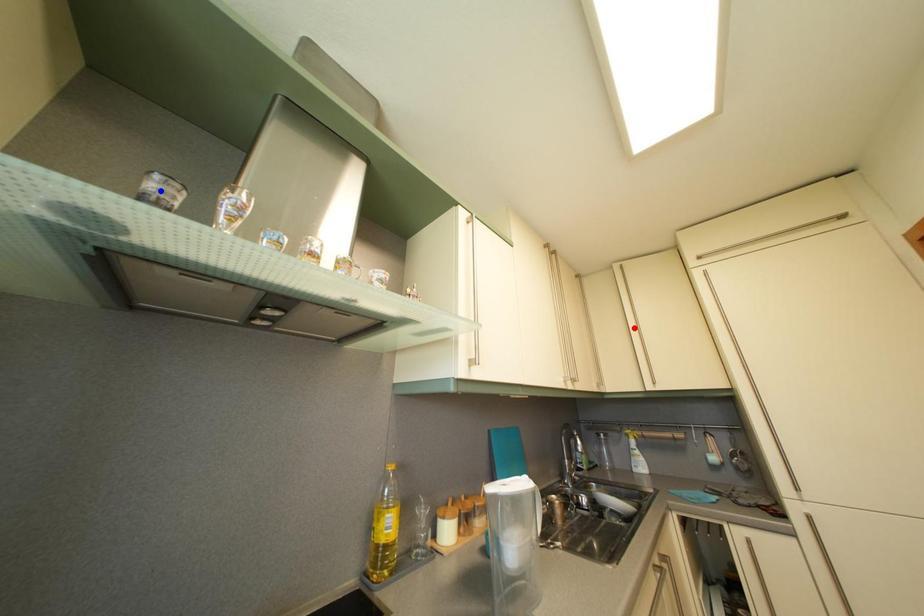
Question: Two points are marked on the image. Which point is closer to the camera?

Choices:
 (A) Blue point is closer.
 (B) Red point is closer.

Answer: (A)